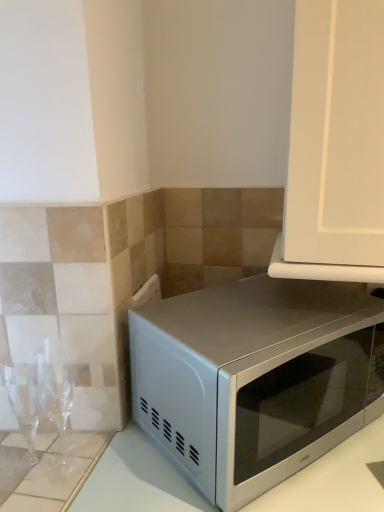
Question: In the image, is satin white microwave at lower right positioned in front of or behind satin silver microwave at lower right?

Choices:
 (A) behind
 (B) front

Answer: (B)

Question: In terms of height, does satin white microwave at lower right look taller or shorter compared to satin silver microwave at lower right?

Choices:
 (A) tall
 (B) short

Answer: (A)

Question: Considering the positions of satin white microwave at lower right and satin silver microwave at lower right in the image, is satin white microwave at lower right wider or thinner than satin silver microwave at lower right?

Choices:
 (A) wide
 (B) thin

Answer: (A)

Question: From a real-world perspective, is satin silver microwave at lower right physically located above or below satin white microwave at lower right?

Choices:
 (A) above
 (B) below

Answer: (A)

Question: Looking at their shapes, would you say satin silver microwave at lower right is wider or thinner than satin white microwave at lower right?

Choices:
 (A) wide
 (B) thin

Answer: (B)

Question: Is point (360, 333) positioned closer to the camera than point (109, 486)?

Choices:
 (A) farther
 (B) closer

Answer: (A)

Question: Considering the positions of satin silver microwave at lower right and satin white microwave at lower right in the image, is satin silver microwave at lower right bigger or smaller than satin white microwave at lower right?

Choices:
 (A) big
 (B) small

Answer: (B)